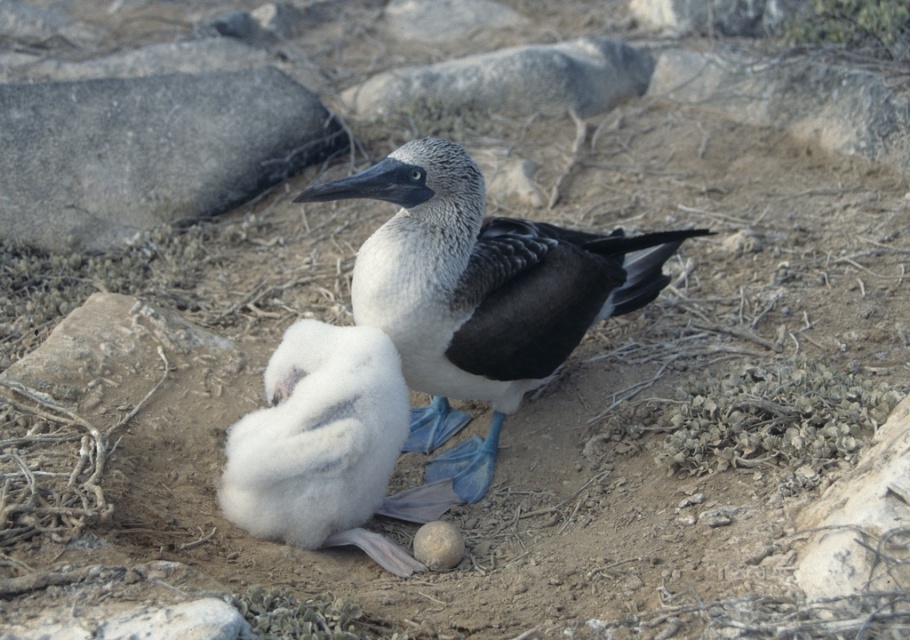
Based on the photo, can you confirm if speckled feathered bird at center is positioned to the right of white fluffy chick at center?

Yes, speckled feathered bird at center is to the right of white fluffy chick at center.

Is point (498, 276) positioned before point (261, 467)?

That is False.

What do you see at coordinates (481, 294) in the screenshot?
I see `speckled feathered bird at center` at bounding box center [481, 294].

This screenshot has height=640, width=910. In order to click on speckled feathered bird at center in this screenshot , I will do `click(481, 294)`.

Who is positioned more to the right, speckled feathered bird at center or smooth gray stone at center?

From the viewer's perspective, speckled feathered bird at center appears more on the right side.

Does speckled feathered bird at center have a smaller size compared to smooth gray stone at center?

No.

Is point (431, 192) more distant than point (440, 552)?

No, (431, 192) is closer to viewer.

Where is `speckled feathered bird at center`? speckled feathered bird at center is located at coordinates (481, 294).

Is white fluffy chick at center further to the viewer compared to smooth gray stone at center?

No.

Does white fluffy chick at center appear under smooth gray stone at center?

Incorrect, white fluffy chick at center is not positioned below smooth gray stone at center.

Between point (311, 339) and point (427, 556), which one is positioned behind?

The point (427, 556) is more distant.

Locate an element on the screen. This screenshot has width=910, height=640. white fluffy chick at center is located at coordinates (326, 445).